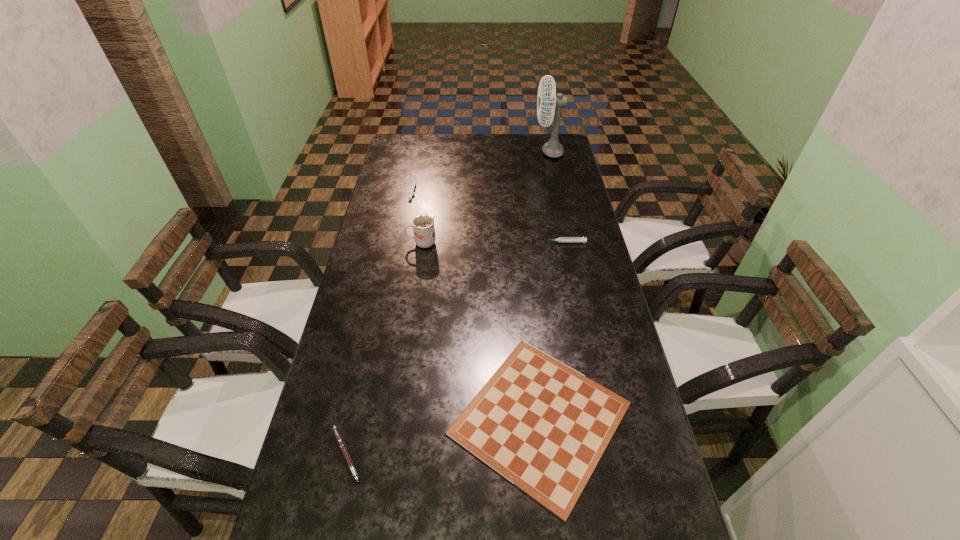
What are the coordinates of `free point located on the front-facing side of the farthest object` in the screenshot? It's located at (502, 152).

Where is `vacant space located on the front-facing side of the farthest object`? The height and width of the screenshot is (540, 960). vacant space located on the front-facing side of the farthest object is located at coordinates (464, 152).

At what (x,y) coordinates should I click in order to perform the action: click on free region located 0.060m on the side with the handle of the fifth shortest object. Please return your answer as a coordinate pair (x, y). The width and height of the screenshot is (960, 540). Looking at the image, I should click on (388, 243).

This screenshot has width=960, height=540. Find the location of `free spot located at the needle end of the nearer syringe`. free spot located at the needle end of the nearer syringe is located at coordinates (456, 242).

The width and height of the screenshot is (960, 540). I want to click on vacant space located 0.190m at the needle end of the nearer syringe, so click(489, 242).

Find the location of a particular element. The height and width of the screenshot is (540, 960). free space located at the needle end of the nearer syringe is located at coordinates (512, 242).

The width and height of the screenshot is (960, 540). I want to click on vacant space situated on the right of the farther syringe, so click(508, 190).

The image size is (960, 540). I want to click on vacant area situated at the nib of the pen, so click(x=422, y=454).

What are the coordinates of `vacant area located on the back of the shortest object` in the screenshot? It's located at (523, 258).

Find the location of a particular element. The image size is (960, 540). object situated at the far edge is located at coordinates (552, 148).